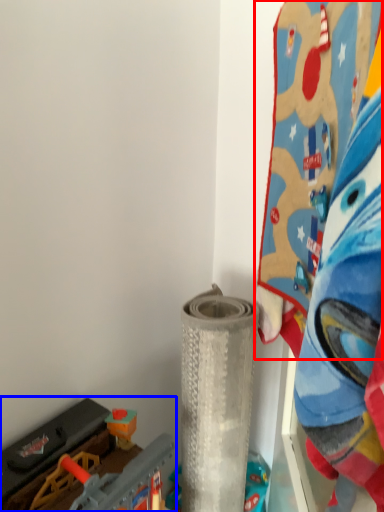
Question: Which point is closer to the camera, toy (highlighted by a red box) or toy (highlighted by a blue box)?

Choices:
 (A) toy
 (B) toy

Answer: (A)